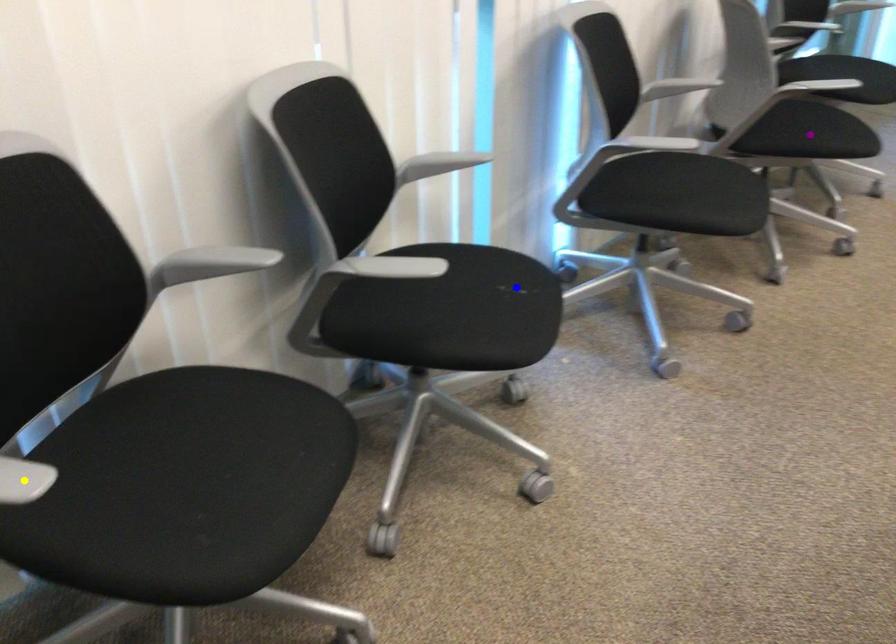
Order these from nearest to farthest:
1. blue point
2. purple point
3. yellow point

yellow point < blue point < purple point